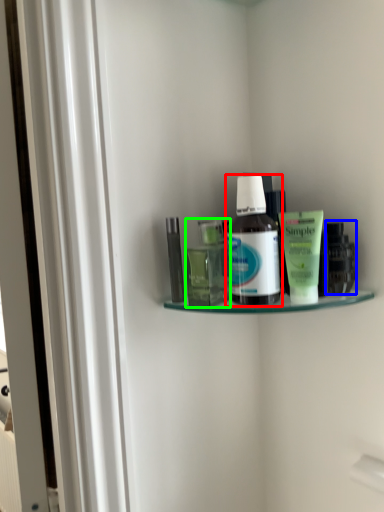
Question: Based on their relative distances, which object is nearer to bottle (highlighted by a red box)? Choose from toiletry (highlighted by a blue box) and toiletry (highlighted by a green box).

Choices:
 (A) toiletry
 (B) toiletry

Answer: (B)